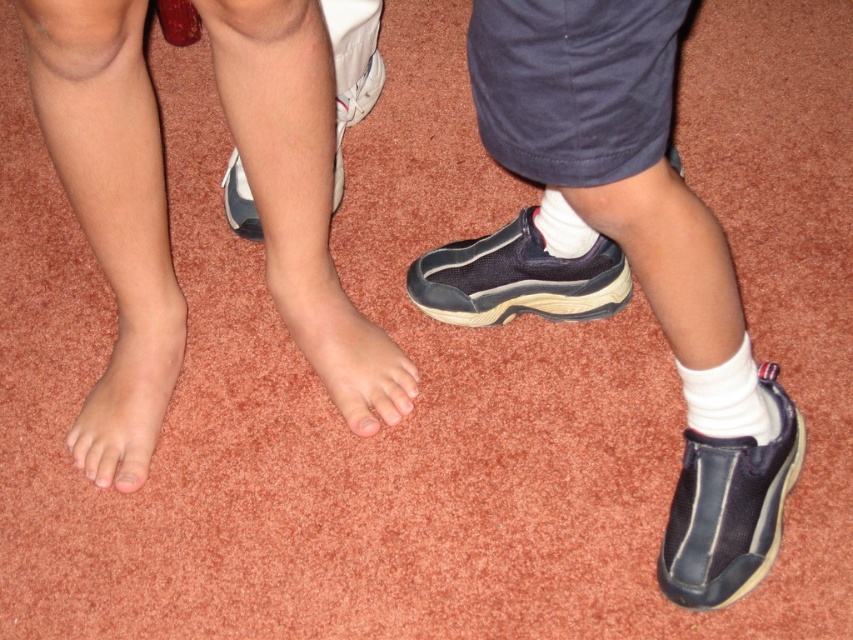
Question: Which object is the closest to the black mesh shoe at center?

Choices:
 (A) matte blue shoe at right
 (B) white soft sock at lower right
 (C) navy blue fabric shoe at lower right
 (D) pink matte toe at center

Answer: (B)

Question: Can you confirm if white leather shoe at center is positioned to the right of pink flesh at lower left?

Choices:
 (A) yes
 (B) no

Answer: (A)

Question: Is white soft sock at center above pink flesh at lower left?

Choices:
 (A) no
 (B) yes

Answer: (B)

Question: Which of the following is the farthest from the observer?

Choices:
 (A) pale skin foot at lower left
 (B) matte blue shoe at right

Answer: (A)

Question: Which object is the closest to the navy blue fabric shoe at lower right?

Choices:
 (A) white leather shoe at center
 (B) white soft sock at center
 (C) matte blue shoe at right
 (D) pale skin foot at lower left

Answer: (C)

Question: Does pale skin foot at lower left have a larger size compared to pink matte toe at center?

Choices:
 (A) no
 (B) yes

Answer: (B)